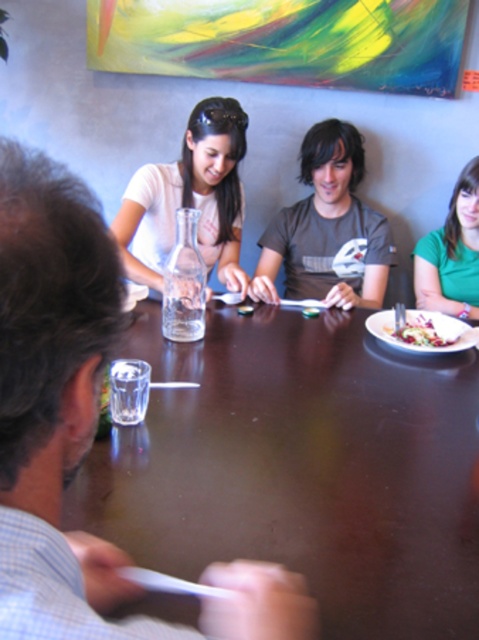
You are a waiter in a restaurant and need to deliver a drink to the table. You see the green matte shirt at upper right and the white matte plate at right. Which object is higher up from the floor?

The green matte shirt at upper right is located above the white matte plate at right, so it is higher up from the floor.

You are sitting at the dark wooden table in the dining scene. You notice two points on the table surface. The first point is at coordinates point (456, 636) and the second point is at coordinates point (460, 285). If you were to move an object from the first point to the second point, in which direction would you move it?

You would move the object from point (456, 636) towards the left direction to reach point (460, 285) since point (456, 636) is in front of point (460, 285).